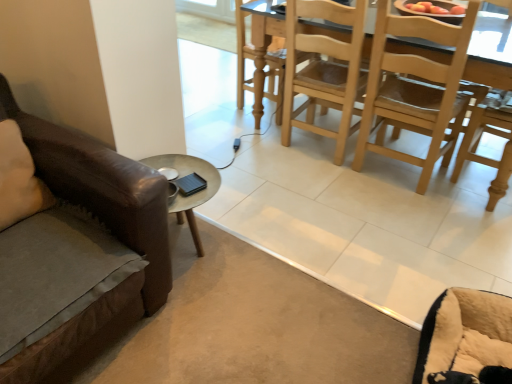
This screenshot has height=384, width=512. What do you see at coordinates (19, 179) in the screenshot?
I see `beige fabric pillow at left` at bounding box center [19, 179].

What is the approximate height of light brown wood chair at center?

36.52 inches.

Find the location of a particular element. This screenshot has width=512, height=384. beige plush swivel chair at lower right is located at coordinates (465, 333).

Find the location of a particular element. beige fabric pillow at left is located at coordinates (19, 179).

The height and width of the screenshot is (384, 512). I want to click on swivel chair located on the left of light brown wooden table at upper right, so click(465, 333).

Is light brown wooden table at upper right to the right of beige plush swivel chair at lower right from the viewer's perspective?

Indeed, light brown wooden table at upper right is positioned on the right side of beige plush swivel chair at lower right.

Does light brown wooden table at upper right have a lesser height compared to beige plush swivel chair at lower right?

Incorrect, the height of light brown wooden table at upper right does not fall short of that of beige plush swivel chair at lower right.

Does light brown wooden table at upper right turn towards beige plush swivel chair at lower right?

Yes, light brown wooden table at upper right is oriented towards beige plush swivel chair at lower right.

Which point is more forward, (476, 338) or (2, 171)?

The point (2, 171) is closer to the camera.

From the picture: From the image's perspective, who appears lower, beige plush swivel chair at lower right or beige fabric pillow at left?

beige plush swivel chair at lower right appears lower in the image.

Which object is thinner, beige plush swivel chair at lower right or beige fabric pillow at left?

beige fabric pillow at left is thinner.

In the scene shown: Considering the relative sizes of beige fabric pillow at left and light brown wood chair at center in the image provided, is beige fabric pillow at left thinner than light brown wood chair at center?

Yes.

Is beige fabric pillow at left touching light brown wood chair at center?

No, beige fabric pillow at left is not beside light brown wood chair at center.

From a real-world perspective, who is located lower, light brown wood chair at center or beige plush swivel chair at lower right?

beige plush swivel chair at lower right, from a real-world perspective.

Is light brown wood chair at center oriented away from beige plush swivel chair at lower right?

light brown wood chair at center does not have its back to beige plush swivel chair at lower right.

From the image's perspective, between light brown wood chair at center and beige plush swivel chair at lower right, who is located below?

beige plush swivel chair at lower right appears lower in the image.

Considering the relative sizes of light brown wood chair at center and beige plush swivel chair at lower right in the image provided, is light brown wood chair at center shorter than beige plush swivel chair at lower right?

Incorrect, the height of light brown wood chair at center does not fall short of that of beige plush swivel chair at lower right.

Locate an element on the screen. Image resolution: width=512 pixels, height=384 pixels. kitchen & dining room table that is on the right side of light brown wood chair at center is located at coordinates (485, 157).

Is light brown wooden table at upper right taller than light brown wood chair at center?

No, light brown wooden table at upper right is not taller than light brown wood chair at center.

From a real-world perspective, is light brown wooden table at upper right on top of light brown wood chair at center?

No, from a real-world perspective, light brown wooden table at upper right is not on top of light brown wood chair at center.

Based on the photo, from the image's perspective, who appears lower, beige plush swivel chair at lower right or light brown wood chair at center?

From the image's view, beige plush swivel chair at lower right is below.

Could you tell me if beige plush swivel chair at lower right is facing light brown wood chair at center?

No, beige plush swivel chair at lower right is not turned towards light brown wood chair at center.

Can you confirm if beige plush swivel chair at lower right is thinner than light brown wood chair at center?

Indeed, beige plush swivel chair at lower right has a lesser width compared to light brown wood chair at center.

Looking at this image, what's the angular difference between light brown wooden table at upper right and beige fabric pillow at left's facing directions?

92.7 degrees.

Image resolution: width=512 pixels, height=384 pixels. What are the coordinates of `pillow on the left of light brown wooden table at upper right` in the screenshot? It's located at (19, 179).

From the image's perspective, does light brown wooden table at upper right appear lower than beige fabric pillow at left?

Actually, light brown wooden table at upper right appears above beige fabric pillow at left in the image.

I want to click on swivel chair lying below the light brown wooden table at upper right (from the image's perspective), so click(465, 333).

This screenshot has width=512, height=384. Find the location of `pillow positioned vertically above the beige plush swivel chair at lower right (from a real-world perspective)`. pillow positioned vertically above the beige plush swivel chair at lower right (from a real-world perspective) is located at coordinates (19, 179).

Estimate the real-world distances between objects in this image. Which object is closer to light brown wooden table at upper right, beige fabric pillow at left or light brown wood chair at center?

The object closer to light brown wooden table at upper right is light brown wood chair at center.

Based on their spatial positions, is light brown wood chair at center or beige plush swivel chair at lower right further from light brown wooden table at upper right?

Among the two, beige plush swivel chair at lower right is located further to light brown wooden table at upper right.

From the picture: Based on their spatial positions, is beige plush swivel chair at lower right or light brown wooden table at upper right closer to light brown wood chair at center?

light brown wooden table at upper right.

Looking at the image, which one is located closer to light brown wooden table at upper right, beige fabric pillow at left or beige plush swivel chair at lower right?

beige plush swivel chair at lower right is positioned closer to the anchor light brown wooden table at upper right.

When comparing their distances from beige plush swivel chair at lower right, does light brown wooden table at upper right or light brown wood chair at center seem closer?

light brown wooden table at upper right lies closer to beige plush swivel chair at lower right than the other object.

Which object lies further to the anchor point beige fabric pillow at left, light brown wood chair at center or light brown wooden table at upper right?

light brown wooden table at upper right is further to beige fabric pillow at left.

Looking at the image, which one is located further to light brown wood chair at center, light brown wooden table at upper right or beige fabric pillow at left?

Among the two, beige fabric pillow at left is located further to light brown wood chair at center.

Based on their spatial positions, is beige fabric pillow at left or light brown wooden table at upper right further from beige plush swivel chair at lower right?

beige fabric pillow at left.

Image resolution: width=512 pixels, height=384 pixels. In order to click on swivel chair between beige fabric pillow at left and light brown wooden table at upper right in the horizontal direction in this screenshot , I will do `click(465, 333)`.

You are a GUI agent. You are given a task and a screenshot of the screen. Output one action in this format:
    pyautogui.click(x=<x>, y=<y>)
    Task: Click on the chair situated between beige fabric pillow at left and beige plush swivel chair at lower right from left to right
    Image resolution: width=512 pixels, height=384 pixels.
    Given the screenshot: What is the action you would take?
    pyautogui.click(x=324, y=69)

The image size is (512, 384). I want to click on chair between beige fabric pillow at left and light brown wooden table at upper right from left to right, so click(x=324, y=69).

Image resolution: width=512 pixels, height=384 pixels. What are the coordinates of `kitchen & dining room table that lies between light brown wood chair at center and beige plush swivel chair at lower right from top to bottom` in the screenshot? It's located at (485, 157).